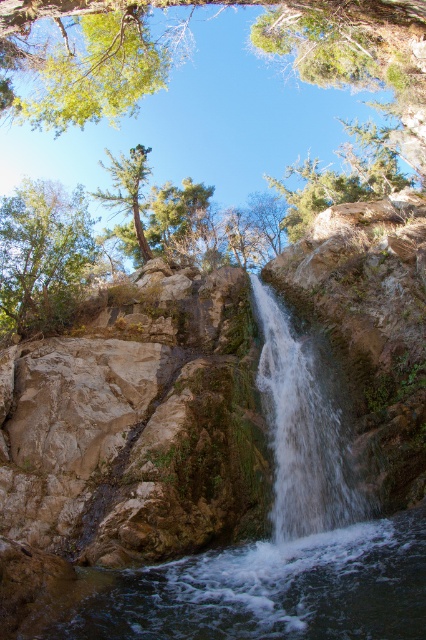
Question: Can you confirm if clear water at center is positioned to the right of green matte tree at upper center?

Choices:
 (A) yes
 (B) no

Answer: (A)

Question: Based on their relative distances, which object is farther from the clear water at center?

Choices:
 (A) green matte tree at upper center
 (B) green leafy tree at upper left

Answer: (A)

Question: Which of the following is the farthest from the observer?

Choices:
 (A) pos(5,262)
 (B) pos(146,170)
 (C) pos(333,609)

Answer: (B)

Question: Which point is farther from the camera taking this photo?

Choices:
 (A) (x=337, y=468)
 (B) (x=138, y=212)
 (C) (x=63, y=312)

Answer: (B)

Question: Does white textured water at center have a smaller size compared to green matte tree at upper center?

Choices:
 (A) yes
 (B) no

Answer: (A)

Question: Is green leafy tree at upper left to the left of green matte tree at upper center from the viewer's perspective?

Choices:
 (A) no
 (B) yes

Answer: (B)